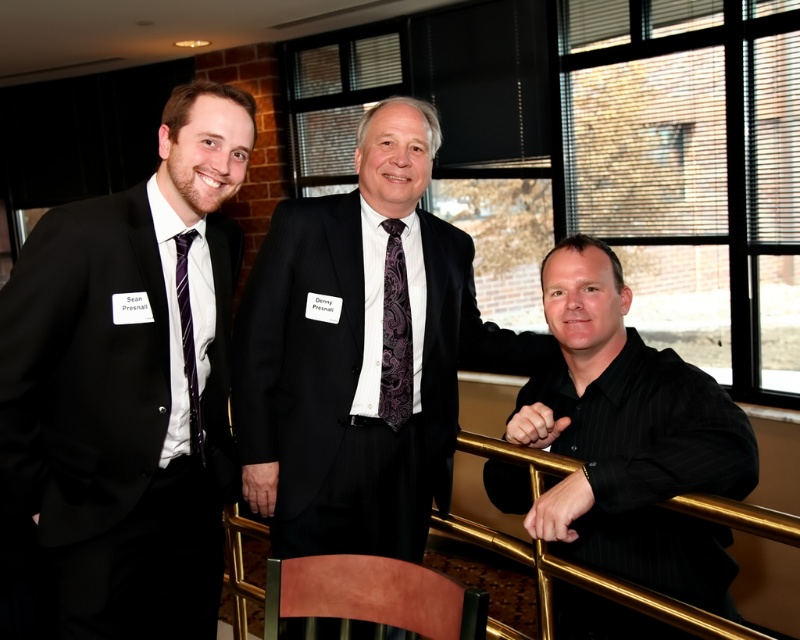
Can you confirm if black pinstripe shirt at right is smaller than purple striped tie at left?

Incorrect, black pinstripe shirt at right is not smaller in size than purple striped tie at left.

Between point (632, 435) and point (190, 442), which one is positioned behind?

The point (190, 442) is more distant.

Locate an element on the screen. black pinstripe shirt at right is located at coordinates (625, 440).

Is the position of purple paisley tie at center more distant than that of purple striped tie at left?

Yes, purple paisley tie at center is further from the viewer.

Between purple paisley tie at center and purple striped tie at left, which one is positioned higher?

purple paisley tie at center is above.

Which is in front, point (388, 317) or point (193, 236)?

Point (193, 236)

What are the coordinates of `purple paisley tie at center` in the screenshot? It's located at [396, 333].

Between matte black suit at center and purple striped tie at left, which one has more height?

matte black suit at center is taller.

Between point (324, 492) and point (192, 432), which one is positioned behind?

The point (324, 492) is behind.

Who is more forward, (409, 132) or (194, 433)?

Point (194, 433) is more forward.

Locate an element on the screen. matte black suit at center is located at coordinates (360, 355).